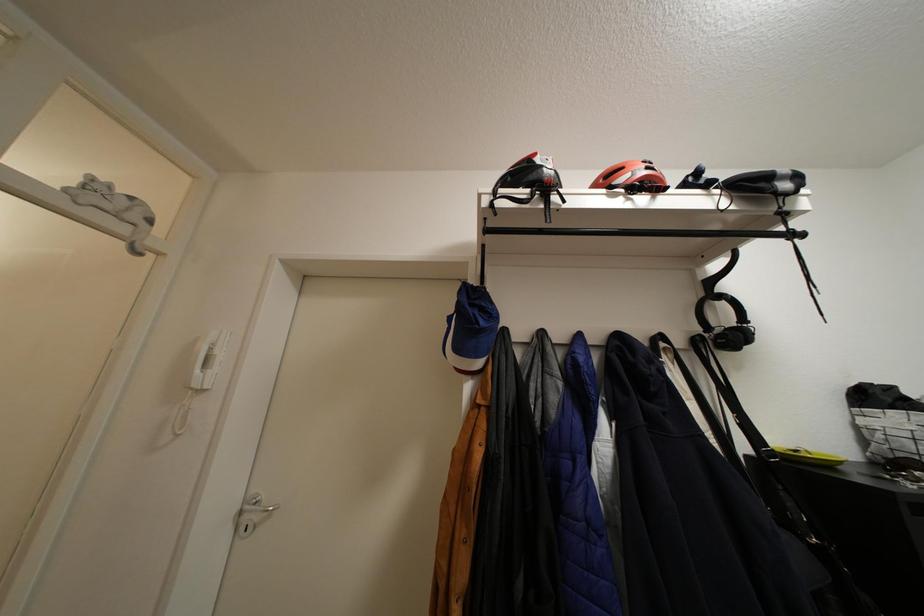
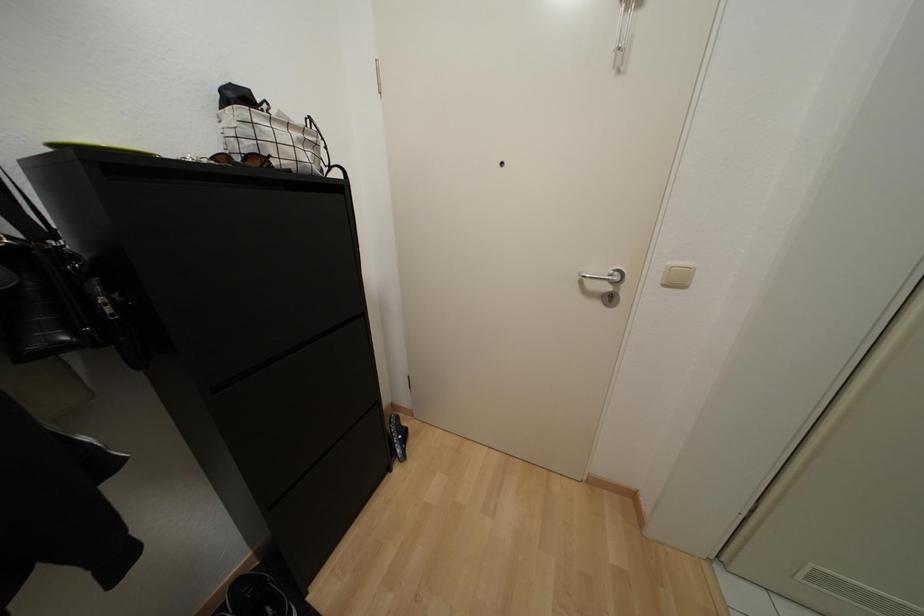
First-person continuous shooting, in which direction is the camera rotating?

The camera rotated toward right-down.